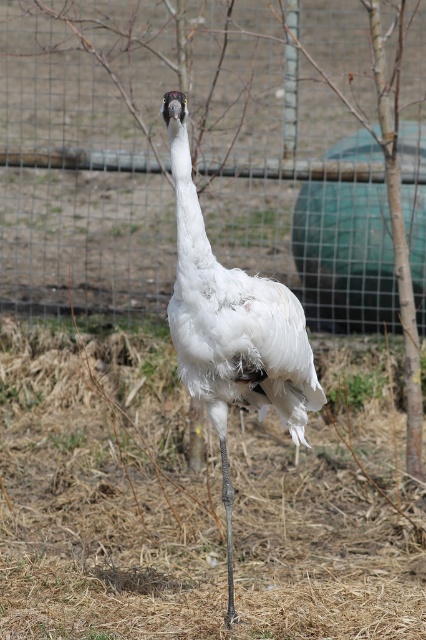
You are a photographer trying to capture the white feathered bird at center and the white fluffy hay at center in a single shot. Which object should you focus on first to ensure both are in frame?

You should focus on the white feathered bird at center first because it is closer to you than the white fluffy hay at center, ensuring both are in frame.

You are a photographer trying to capture the white feathered bird at center without the wire mesh fence at center appearing in the shot. Based on their positions, can you position yourself in a way to exclude the fence from the frame?

The wire mesh fence at center is to the left of the white feathered bird at center, so if you move to the right side of the bird, you can position yourself such that the fence is out of the frame to the left while keeping the bird centered.